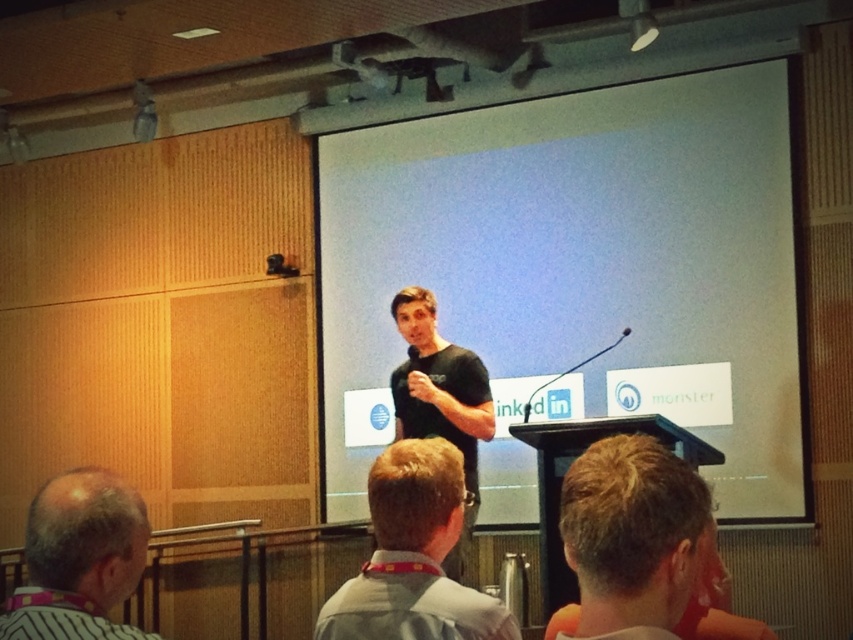
The height and width of the screenshot is (640, 853). What do you see at coordinates (633, 536) in the screenshot?
I see `blonde hair at upper center` at bounding box center [633, 536].

Is blonde hair at upper center positioned in front of black matte shirt at center?

Yes.

Between point (573, 502) and point (461, 378), which one is positioned behind?

The point (461, 378) is more distant.

Where is `blonde hair at upper center`? The width and height of the screenshot is (853, 640). blonde hair at upper center is located at coordinates (633, 536).

Does light brown hair at center have a greater width compared to black matte shirt at center?

No, light brown hair at center is not wider than black matte shirt at center.

Is point (427, 458) in front of point (398, 298)?

Yes, it is in front of point (398, 298).

This screenshot has width=853, height=640. What are the coordinates of `light brown hair at center` in the screenshot? It's located at (413, 556).

The height and width of the screenshot is (640, 853). Describe the element at coordinates (577, 273) in the screenshot. I see `black matte t-shirt at center` at that location.

Is black matte t-shirt at center to the right of black matte shirt at center from the viewer's perspective?

Correct, you'll find black matte t-shirt at center to the right of black matte shirt at center.

Image resolution: width=853 pixels, height=640 pixels. What do you see at coordinates (577, 273) in the screenshot?
I see `black matte t-shirt at center` at bounding box center [577, 273].

This screenshot has height=640, width=853. Find the location of `black matte t-shirt at center`. black matte t-shirt at center is located at coordinates (577, 273).